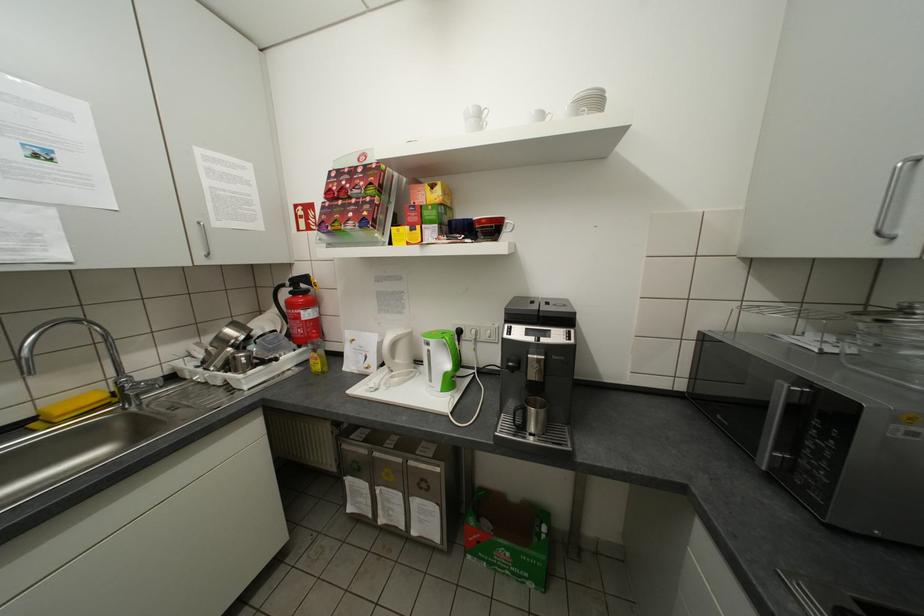
The height and width of the screenshot is (616, 924). Find the location of `extinguisher handle`. extinguisher handle is located at coordinates (299, 309).